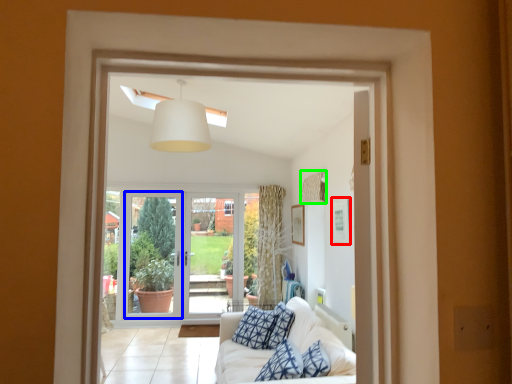
Question: Which object is positioned farthest from picture frame (highlighted by a red box)? Select from screen door (highlighted by a blue box) and curtain (highlighted by a green box).

Choices:
 (A) screen door
 (B) curtain

Answer: (A)